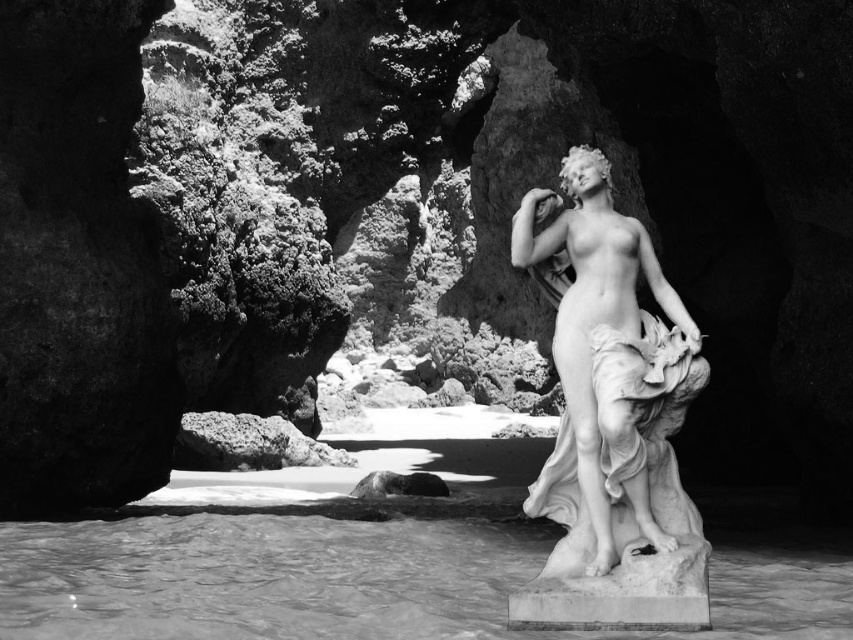
Which is above, translucent white water at lower center or white marble statue at center?

white marble statue at center

Which is in front, point (511, 545) or point (538, 618)?

Point (538, 618)

Where is `translucent white water at lower center`? translucent white water at lower center is located at coordinates (361, 580).